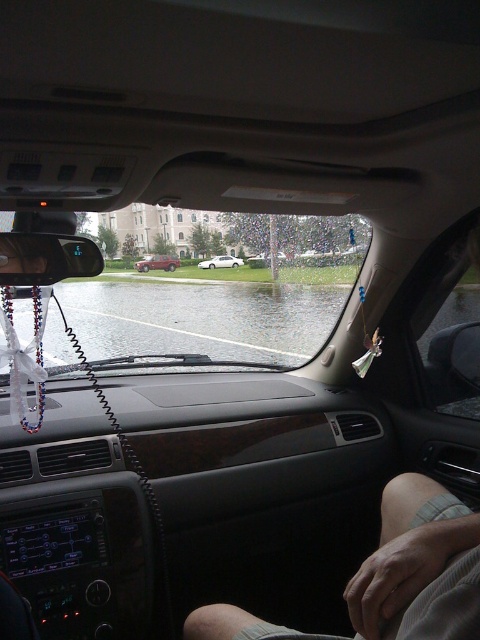
Does metallic silver sedan at center have a greater height compared to white glossy sedan at center?

Yes.

Where is `metallic silver sedan at center`? metallic silver sedan at center is located at coordinates click(x=156, y=262).

At what (x,y) coordinates should I click in order to perform the action: click on metallic silver sedan at center. Please return your answer as a coordinate pair (x, y). Looking at the image, I should click on (156, 262).

Between skinny shorts at lower right and matte plastic rearview mirror at upper left, which one is positioned lower?

skinny shorts at lower right

This screenshot has height=640, width=480. What do you see at coordinates (419, 566) in the screenshot? I see `skinny shorts at lower right` at bounding box center [419, 566].

Is point (446, 522) in front of point (28, 246)?

Yes, it is in front of point (28, 246).

Locate an element on the screen. This screenshot has width=480, height=640. skinny shorts at lower right is located at coordinates (419, 566).

Does clear liquid water at center appear over skinny shorts at lower right?

Correct, clear liquid water at center is located above skinny shorts at lower right.

I want to click on clear liquid water at center, so click(x=202, y=317).